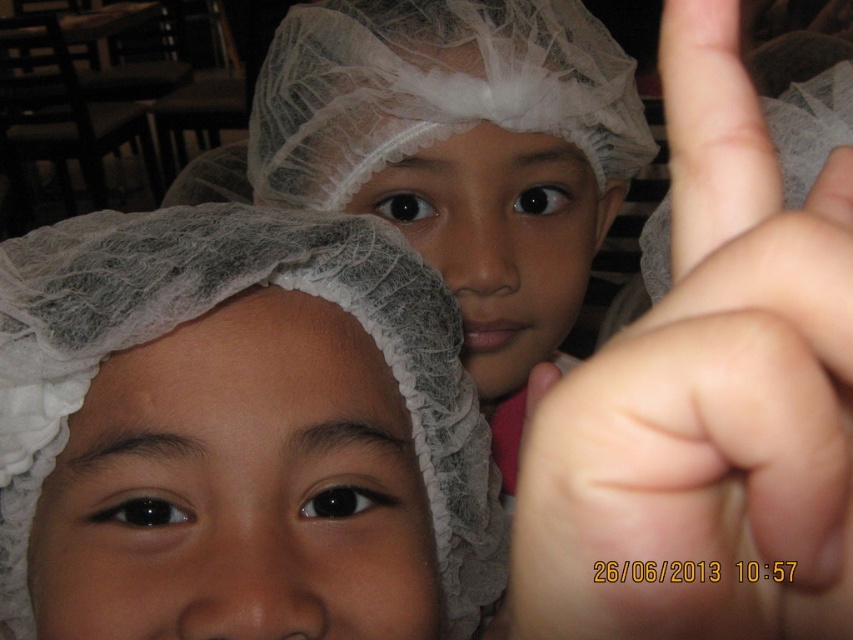
Question: Is white mesh cap at upper left below skin/smooth/finger at upper right?

Choices:
 (A) yes
 (B) no

Answer: (A)

Question: Among these points, which one is farthest from the camera?

Choices:
 (A) (199, 221)
 (B) (798, 113)
 (C) (746, 410)

Answer: (B)

Question: Does white mesh cap at upper left have a greater width compared to skin/smooth/finger at upper right?

Choices:
 (A) yes
 (B) no

Answer: (A)

Question: Which object is the farthest from the skin/smooth/finger at upper right?

Choices:
 (A) white matte finger at upper right
 (B) white mesh cap at upper left

Answer: (B)

Question: Is white matte finger at upper right smaller than skin/smooth/finger at upper right?

Choices:
 (A) no
 (B) yes

Answer: (B)

Question: Which of the following is the closest to the observer?

Choices:
 (A) white matte finger at upper right
 (B) skin/smooth/finger at upper right

Answer: (A)